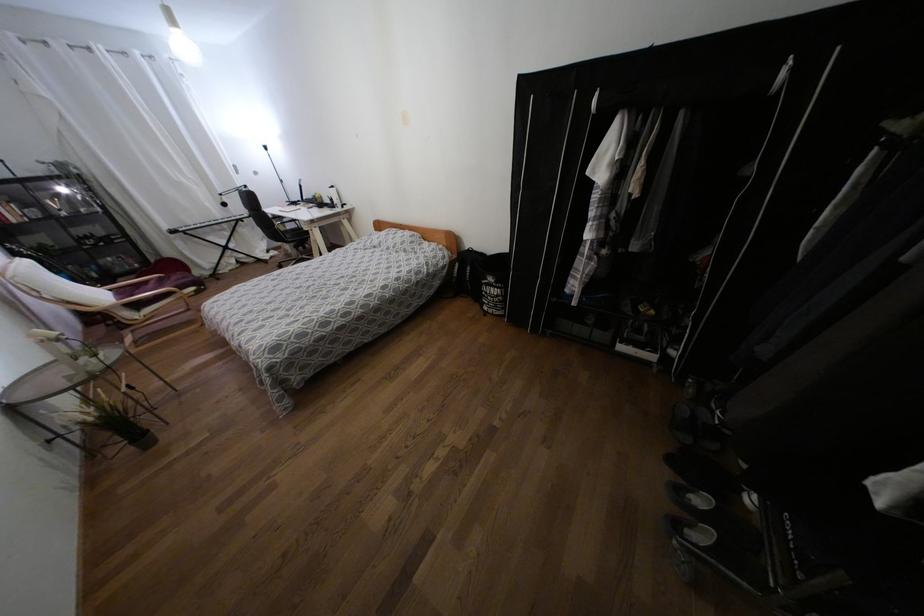
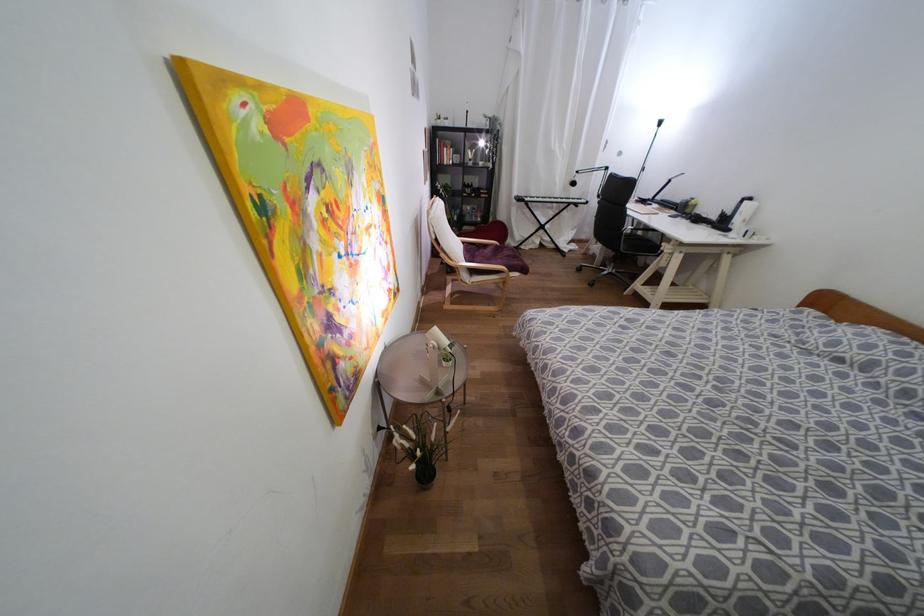
In the second image, find the point that corresponds to the point at 224,204 in the first image.

(573, 183)